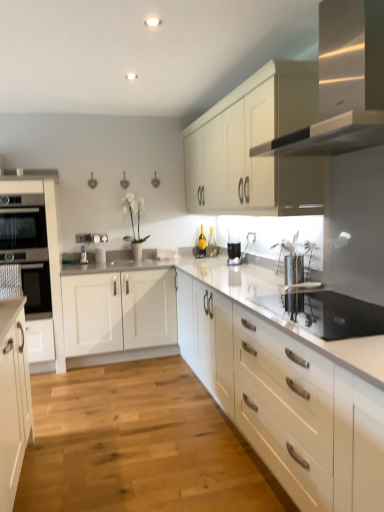
Question: In terms of height, does light wood floor at center look taller or shorter compared to white matte cabinet at center, the 1th cabinetry viewed from the right?

Choices:
 (A) tall
 (B) short

Answer: (B)

Question: From the image's perspective, is light wood floor at center positioned above or below white matte cabinet at center, the 1th cabinetry viewed from the right?

Choices:
 (A) below
 (B) above

Answer: (A)

Question: Based on their relative distances, which object is nearer to the satin nickel faucet at center?

Choices:
 (A) stainless steel oven at center
 (B) white matte cabinet at center, the 1th cabinetry viewed from the right
 (C) satin silver range hood at upper right
 (D) white matte cabinet at upper center, which is counted as the 2th cabinetry, starting from the left
 (E) satin white oven at left, the 1th cabinetry positioned from the left

Answer: (E)

Question: Based on their relative distances, which object is farther from the light wood floor at center?

Choices:
 (A) white matte cabinet at upper center, marked as the second cabinetry in a right-to-left arrangement
 (B) satin nickel faucet at center
 (C) satin white oven at left, the third cabinetry viewed from the right
 (D) stainless steel oven at center
 (E) satin silver range hood at upper right

Answer: (B)